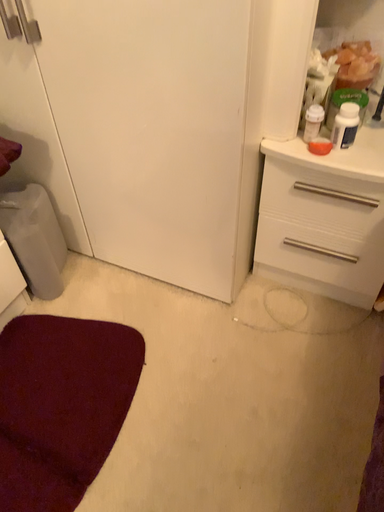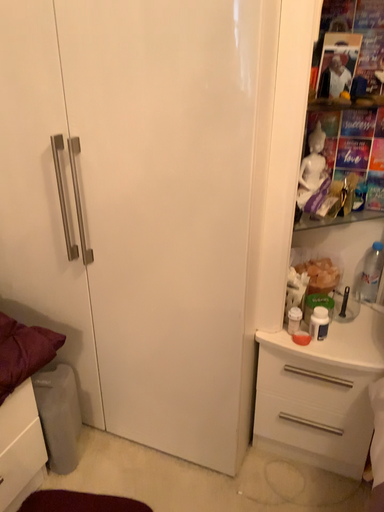
Question: How did the camera likely rotate when shooting the video?

Choices:
 (A) rotated downward
 (B) rotated upward

Answer: (B)